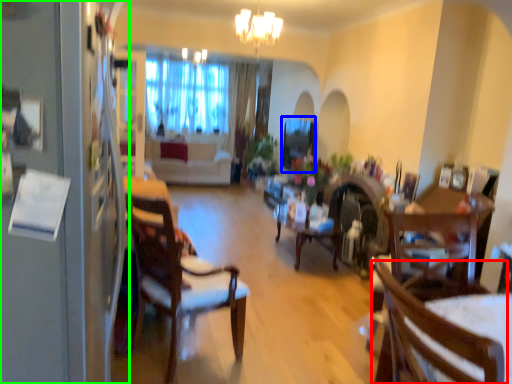
Question: Which object is the closest to the chair (highlighted by a red box)? Choose among these: window screen (highlighted by a blue box) or fridge (highlighted by a green box).

Choices:
 (A) window screen
 (B) fridge

Answer: (B)